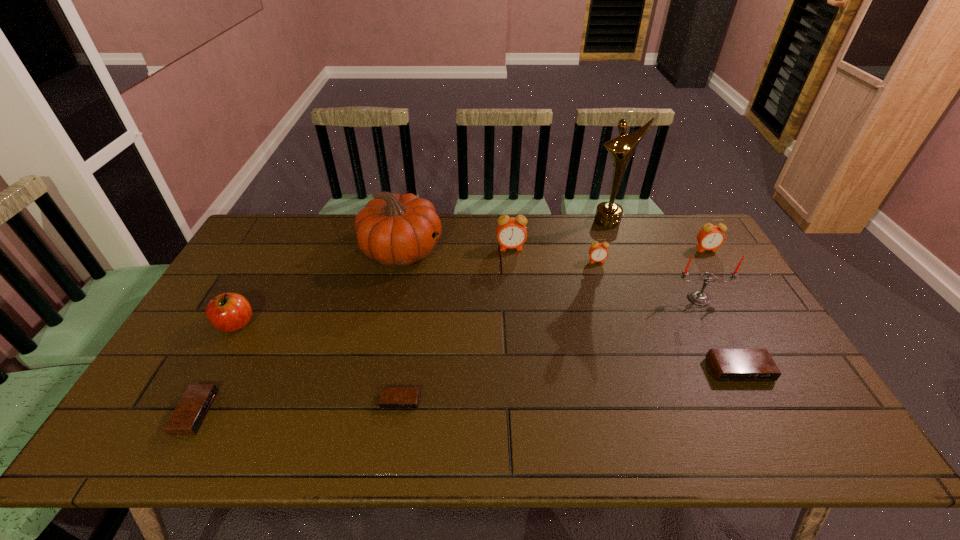
Locate an element on the screen. Image resolution: width=960 pixels, height=540 pixels. vacant space situated on the front-facing side of the sixth farthest object is located at coordinates (715, 329).

Locate an element on the screen. This screenshot has width=960, height=540. vacant space located 0.230m on the face of the biggest pink alarm clock is located at coordinates (516, 300).

Where is `vacant area situated 0.400m on the face of the second smallest pink alarm clock`? Image resolution: width=960 pixels, height=540 pixels. vacant area situated 0.400m on the face of the second smallest pink alarm clock is located at coordinates (765, 346).

At what (x,y) coordinates should I click in order to perform the action: click on vacant space situated 0.260m on the right of the apple. Please return your answer as a coordinate pair (x, y). The width and height of the screenshot is (960, 540). Looking at the image, I should click on (348, 324).

Locate an element on the screen. This screenshot has width=960, height=540. vacant space located on the face of the fourth nearest alarm clock is located at coordinates tap(621, 342).

Locate an element on the screen. vacant space situated 0.130m on the front face of the rightmost black alarm clock is located at coordinates (772, 430).

Identify the location of vacant space located on the front face of the second biggest black alarm clock. (344, 412).

This screenshot has width=960, height=540. In order to click on vacant space located on the front face of the smallest black alarm clock in this screenshot , I will do `click(396, 433)`.

The width and height of the screenshot is (960, 540). I want to click on award that is at the far edge, so click(608, 215).

I want to click on pumpkin that is at the far edge, so click(x=393, y=229).